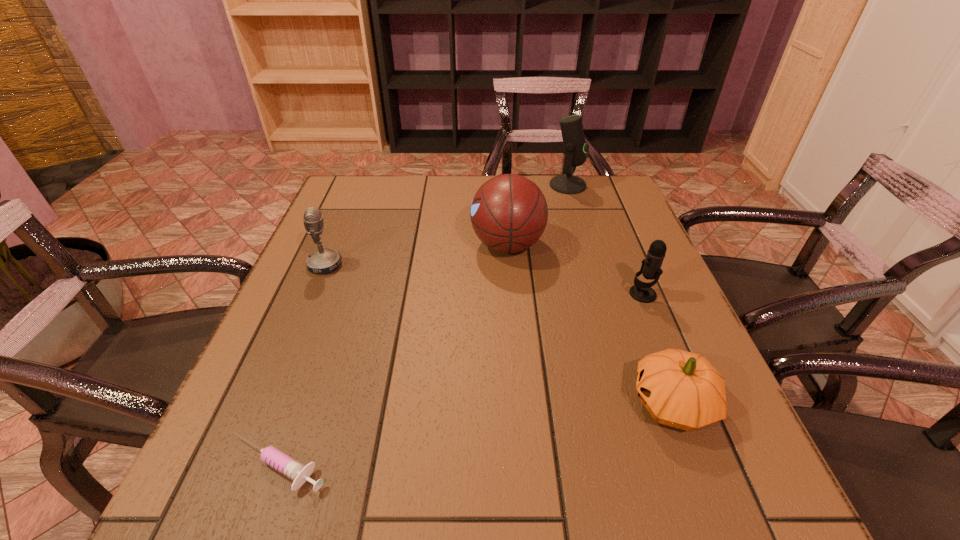
Image resolution: width=960 pixels, height=540 pixels. In order to click on gourd that is at the right edge in this screenshot , I will do `click(681, 389)`.

Find the location of a particular element. Image resolution: width=960 pixels, height=540 pixels. object situated at the near left corner is located at coordinates (297, 472).

Where is `object positioned at the far right corner`? Image resolution: width=960 pixels, height=540 pixels. object positioned at the far right corner is located at coordinates (575, 148).

Where is `free space at the far edge`? Image resolution: width=960 pixels, height=540 pixels. free space at the far edge is located at coordinates (404, 181).

Locate an element on the screen. vacant space at the near edge of the desktop is located at coordinates (364, 484).

Locate an element on the screen. This screenshot has width=960, height=540. blank area at the left edge is located at coordinates (366, 250).

This screenshot has width=960, height=540. In the image, there is a desktop. Find the location of `vacant space at the right edge`. vacant space at the right edge is located at coordinates (612, 284).

Find the location of `vacant space at the far left corner of the desktop`. vacant space at the far left corner of the desktop is located at coordinates (326, 211).

Where is `vacant space at the far right corner of the desktop`? The height and width of the screenshot is (540, 960). vacant space at the far right corner of the desktop is located at coordinates (600, 197).

Locate an element on the screen. This screenshot has width=960, height=540. free space at the near right corner of the desktop is located at coordinates (766, 507).